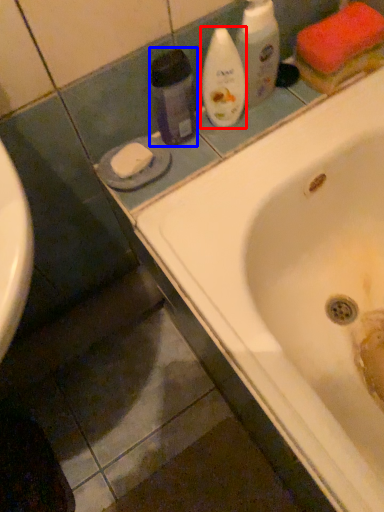
Question: Which object is further to the camera taking this photo, cleaning product (highlighted by a red box) or cleaning product (highlighted by a blue box)?

Choices:
 (A) cleaning product
 (B) cleaning product

Answer: (A)